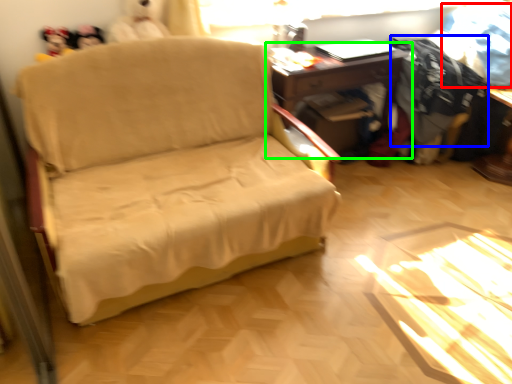
Question: Considering the real-world distances, which object is closest to clothing (highlighted by a red box)? clothing (highlighted by a blue box) or table (highlighted by a green box).

Choices:
 (A) clothing
 (B) table

Answer: (A)